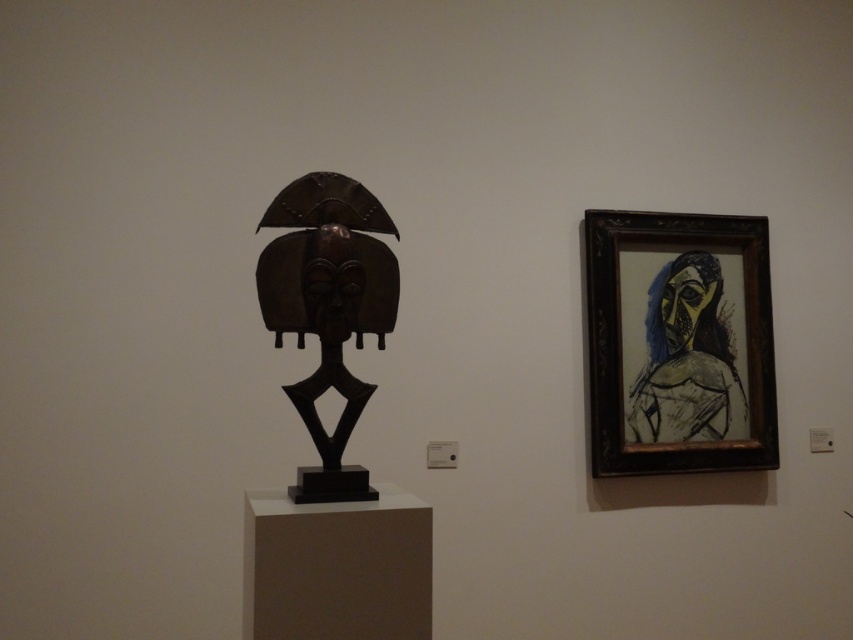
You are an art critic standing in front of the two artworks. You notice two points marked on the wall. One is labeled as point 1 at coordinates [602,436] and the other is point 2 at coordinates [326,470]. Which point is closer to you?

Point 1 at coordinates [602,436] is further to the camera than point 2 at coordinates [326,470], so point 2 is closer to you.

You are an art conservator standing in front of the shiny brown wood mask at left. Your task is to clean it with a cloth that is 4 feet long. Can you reach the top of the mask without moving your position?

The shiny brown wood mask at left is 5.22 feet away from the viewer. Since the cloth is only 4 feet long, you cannot reach the top of the mask without moving your position.